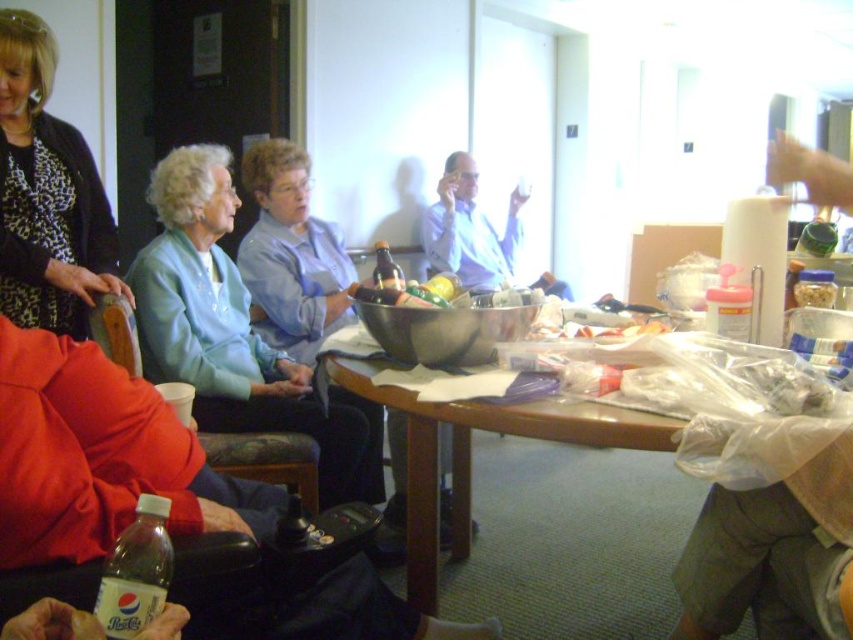
Based on the photo, does leopard print fabric at upper left have a greater width compared to brown glossy table at center?

No, leopard print fabric at upper left is not wider than brown glossy table at center.

Between leopard print fabric at upper left and brown glossy table at center, which one has less height?

brown glossy table at center

Between point (65, 298) and point (436, 522), which one is positioned behind?

The point (65, 298) is more distant.

What are the coordinates of `leopard print fabric at upper left` in the screenshot? It's located at (47, 195).

Is white paper towel at right positioned in front of leopard print fabric at upper left?

Yes, it is.

Identify the location of white paper towel at right. This screenshot has width=853, height=640. (773, 554).

Is light blue fabric jacket at upper left above brown glossy table at center?

Indeed, light blue fabric jacket at upper left is positioned over brown glossy table at center.

Measure the distance from light blue fabric jacket at upper left to brown glossy table at center.

A distance of 26.48 inches exists between light blue fabric jacket at upper left and brown glossy table at center.

Locate an element on the screen. light blue fabric jacket at upper left is located at coordinates (235, 332).